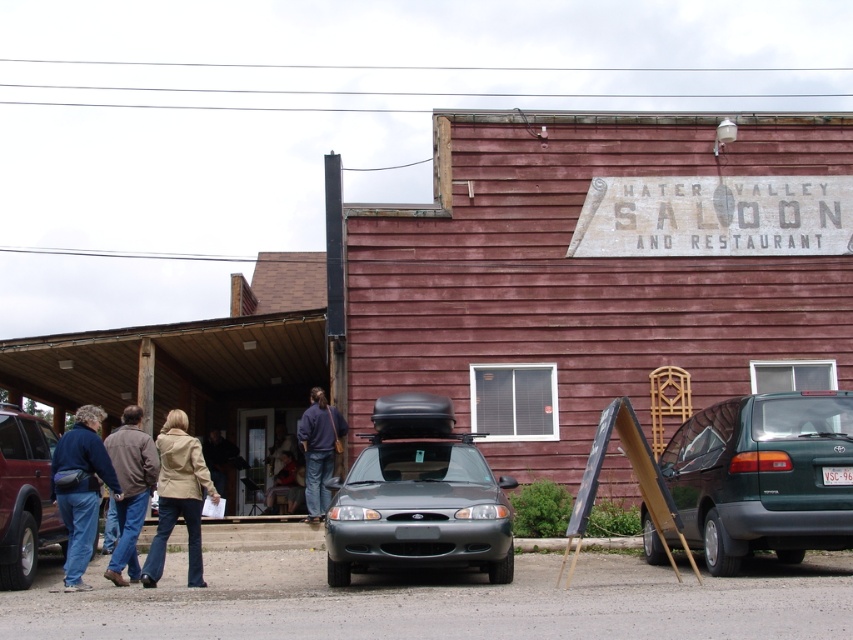
You are standing in front of the HATER VALLEY SALOON AND RESTAURANT and see two denim jackets. One is the denim jacket at left and the other is the denim jacket at lower center. Which denim jacket is nearer to you?

The denim jacket at left is closer to the viewer than denim jacket at lower center.

You are trying to park your new car, which is 1.8 meters wide, in the parking area between the matte gray car at center and the matte black suv at left. Based on the scene, can your car fit in that space?

The matte gray car at center might be wider than matte black suv at left, so the space between them may not be wide enough for your 1.8 meter wide car. Check the actual width before parking.

You are standing in front of the HATER VALLEY SALOON AND RESTAURANT and need to locate the denim jacket at left. According to the coordinates provided, where exactly should you look to find it?

The denim jacket at left is located at the coordinate point of [80,488], which means it is positioned on the left side of the image near the top edge.